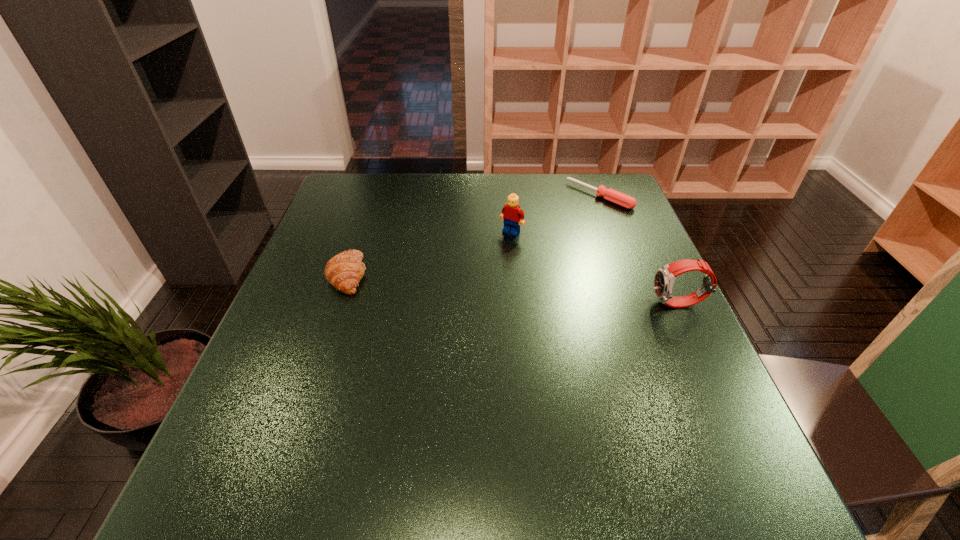
This screenshot has width=960, height=540. What are the coordinates of `screwdriver situated at the right edge` in the screenshot? It's located at (621, 199).

The width and height of the screenshot is (960, 540). What are the coordinates of `object that is at the far right corner` in the screenshot? It's located at pyautogui.click(x=621, y=199).

Locate an element on the screen. Image resolution: width=960 pixels, height=540 pixels. free location at the far edge of the desktop is located at coordinates (471, 184).

Find the location of a particular element. The image size is (960, 540). vacant area at the near edge of the desktop is located at coordinates (370, 427).

Locate an element on the screen. free space at the left edge of the desktop is located at coordinates (321, 319).

In the image, there is a desktop. Where is `vacant space at the right edge`? vacant space at the right edge is located at coordinates (644, 330).

Where is `free space at the far left corner`? free space at the far left corner is located at coordinates (339, 186).

In the image, there is a desktop. Where is `vacant space at the far right corner`? The width and height of the screenshot is (960, 540). vacant space at the far right corner is located at coordinates (606, 183).

The width and height of the screenshot is (960, 540). Find the location of `free space that is in between the watch and the shortest object`. free space that is in between the watch and the shortest object is located at coordinates (639, 250).

Find the location of a particular element. vacant point located between the crescent roll and the shortest object is located at coordinates (474, 235).